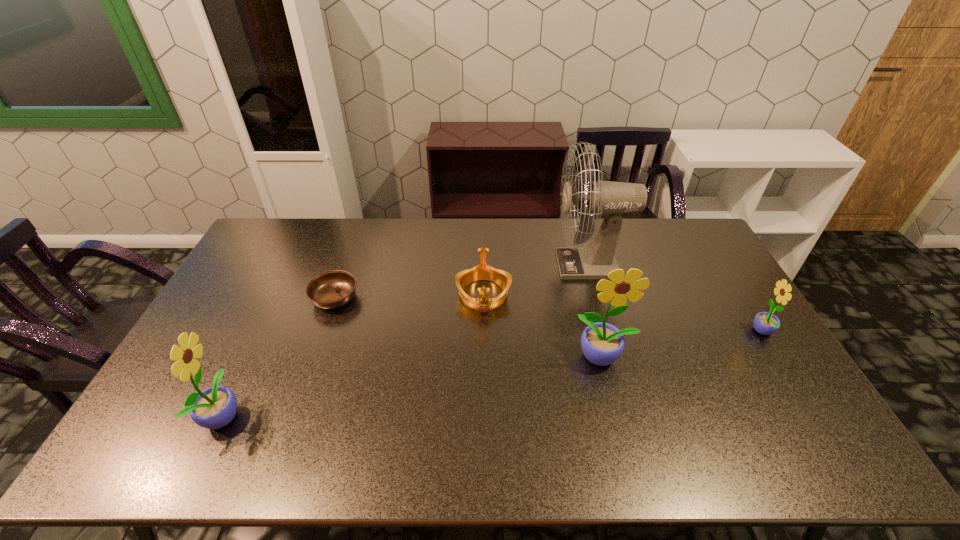
At what (x,y) coordinates should I click in order to perform the action: click on vacant area that lies between the rightmost sunflower and the fifth object from right to left. Please return your answer as a coordinate pair (x, y). The width and height of the screenshot is (960, 540). Looking at the image, I should click on (549, 315).

Locate an element on the screen. The image size is (960, 540). free area in between the shortest sunflower and the shortest object is located at coordinates (549, 315).

I want to click on blank region between the second sunflower from left to right and the tallest object, so click(596, 311).

This screenshot has width=960, height=540. I want to click on unoccupied area between the tallest object and the shortest sunflower, so click(676, 299).

Identify the location of vacant point located between the second sunflower from left to right and the second shortest sunflower. This screenshot has width=960, height=540. (413, 386).

Where is `vacant area between the fan and the fourth shortest object`? This screenshot has width=960, height=540. vacant area between the fan and the fourth shortest object is located at coordinates (407, 340).

Identify the location of free spot between the tiara and the tallest object. pos(537,280).

The image size is (960, 540). I want to click on empty space that is in between the nearest sunflower and the fourth tallest object, so click(x=493, y=374).

Image resolution: width=960 pixels, height=540 pixels. What are the coordinates of `vacant space that's between the tallest object and the tiara` in the screenshot? It's located at pos(537,280).

Locate an element on the screen. The height and width of the screenshot is (540, 960). vacant point located between the third object from left to right and the second sunflower from right to left is located at coordinates (543, 326).